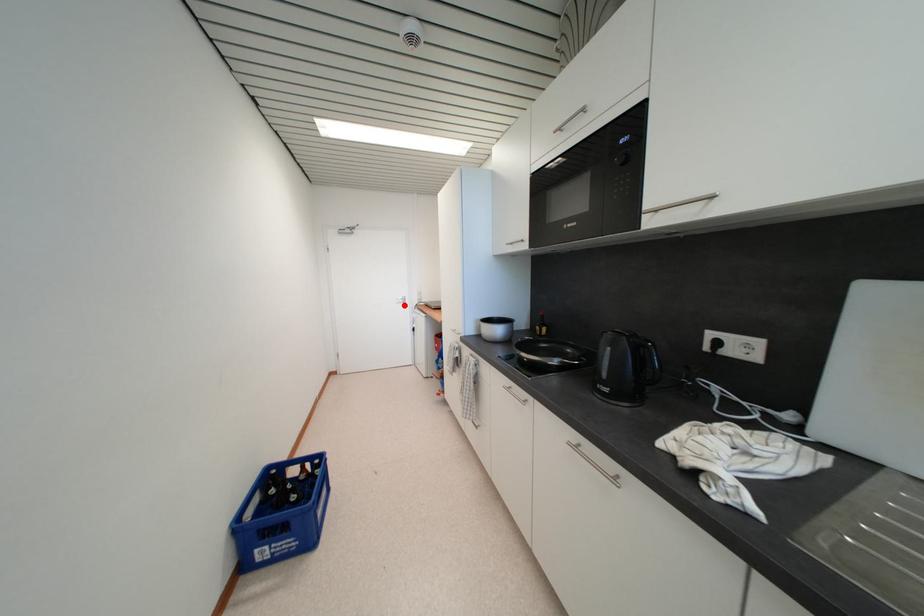
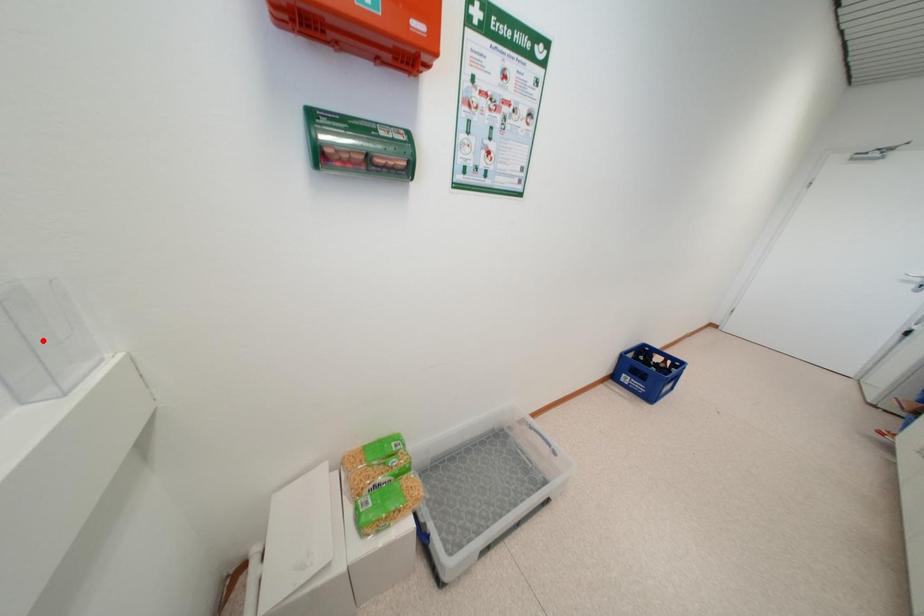
I am providing you with two images of the same scene from different viewpoints. A red point is marked on the first image and another point is marked on the second image. Do the highlighted points in image1 and image2 indicate the same real-world spot?

No